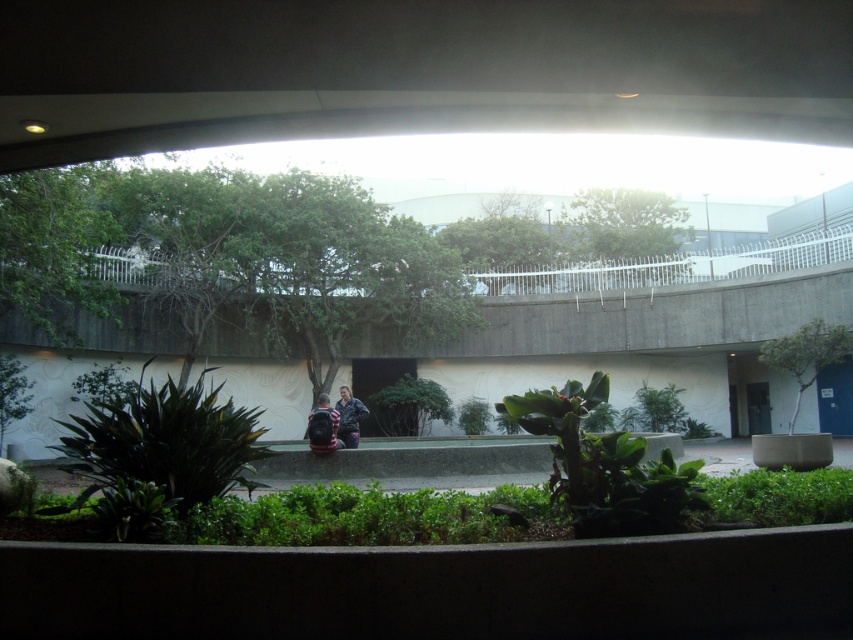
You are standing under the curved overpass and looking at the scene. There is a point marked at coordinates (160, 451). What object is located at that point?

The dark green leafy plant at center is located at point (160, 451).

You are standing under the curved overpass and want to place a small statue exactly at the center of the image. Is the dark green leafy plant at center in the way?

The dark green leafy plant at center is located at point (160,451), which is not the exact center of the image. Therefore, placing the statue at the center would not be obstructed by the plant.